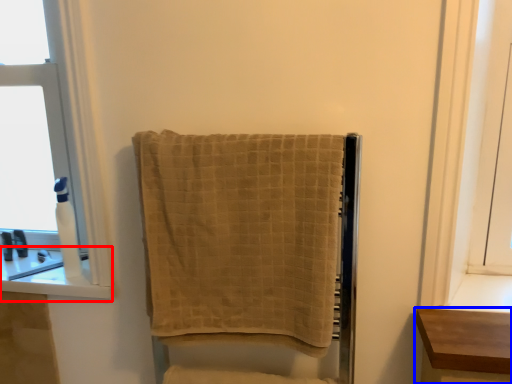
Question: Which point is further to the camera, window sill (highlighted by a red box) or furniture (highlighted by a blue box)?

Choices:
 (A) window sill
 (B) furniture

Answer: (A)